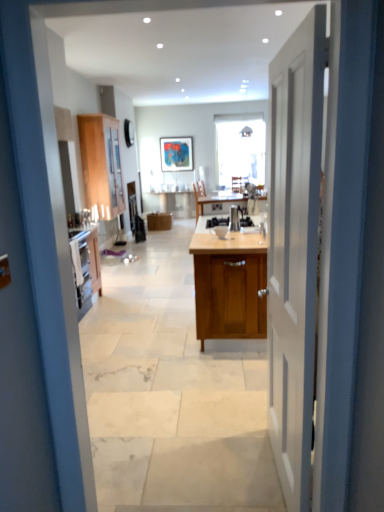
The height and width of the screenshot is (512, 384). I want to click on free spot in front of wooden cabinet at center, which is the 3th cabinetry from left to right, so click(x=175, y=386).